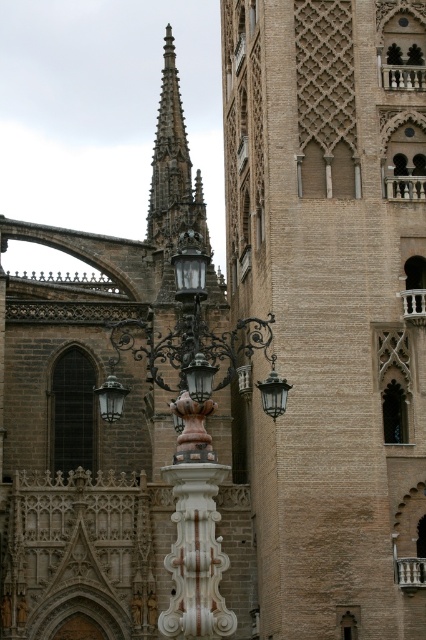
Question: Does smooth stone spire at center have a smaller size compared to bronze textured lamp at center?

Choices:
 (A) yes
 (B) no

Answer: (B)

Question: Which of the following is the closest to the observer?

Choices:
 (A) (184, 508)
 (B) (178, 164)
 (C) (241, 176)

Answer: (A)

Question: Which of the following is the farthest from the observer?

Choices:
 (A) smooth stone spire at center
 (B) bronze textured lamp at center
 (C) white marble column at center
 (D) brown brick tower at center

Answer: (A)

Question: Can you confirm if smooth stone spire at center is positioned below bronze textured lamp at center?

Choices:
 (A) yes
 (B) no

Answer: (B)

Question: Is white marble column at center above smooth stone spire at center?

Choices:
 (A) yes
 (B) no

Answer: (B)

Question: Estimate the real-world distances between objects in this image. Which object is farther from the brown brick tower at center?

Choices:
 (A) white marble column at center
 (B) bronze textured lamp at center

Answer: (A)